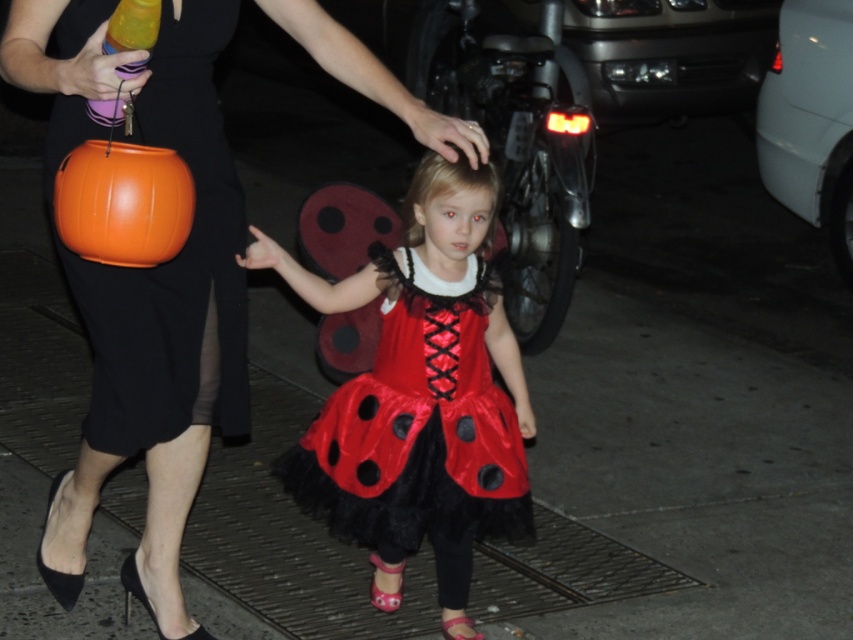
What do you see at coordinates (173, 266) in the screenshot?
I see `orange plastic bucket at left` at bounding box center [173, 266].

Is point (96, 275) closer to camera compared to point (180, 161)?

No, (96, 275) is further to viewer.

Image resolution: width=853 pixels, height=640 pixels. I want to click on orange plastic bucket at left, so click(x=173, y=266).

Does matte black dress at center come behind shiny satin dress at center?

No, it is not.

Which of these two, matte black dress at center or shiny satin dress at center, stands taller?

matte black dress at center is taller.

At what (x,y) coordinates should I click in order to perform the action: click on matte black dress at center. Please return your answer as a coordinate pair (x, y). The image size is (853, 640). Looking at the image, I should click on (146, 282).

The width and height of the screenshot is (853, 640). Find the location of `matte black dress at center`. matte black dress at center is located at coordinates click(146, 282).

Who is positioned more to the right, matte black dress at center or orange matte pumpkin at left?

matte black dress at center

The width and height of the screenshot is (853, 640). What are the coordinates of `matte black dress at center` in the screenshot? It's located at (146, 282).